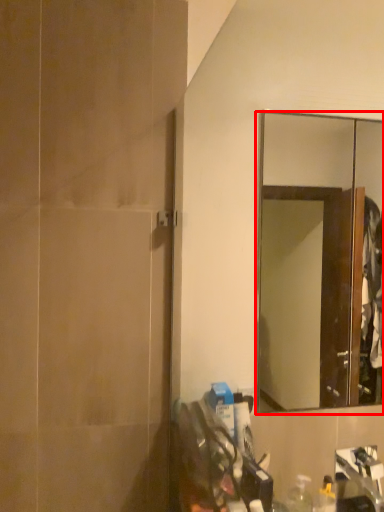
Question: From the image's perspective, what is the correct spatial positioning of mirror (annotated by the red box) in reference to screen door?

Choices:
 (A) below
 (B) above

Answer: (A)